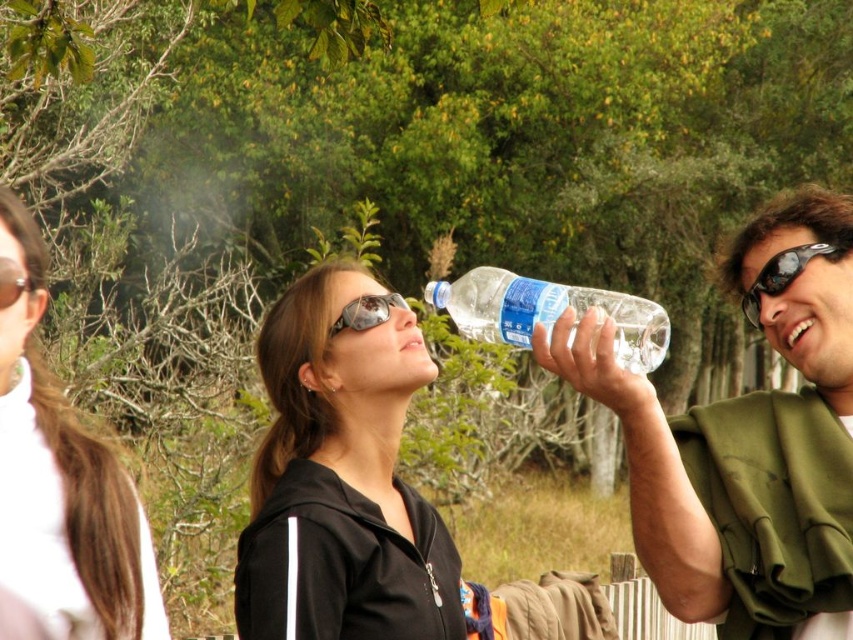
Does matte green scarf at right appear on the left side of matte black goggles at upper center?

No, matte green scarf at right is not to the left of matte black goggles at upper center.

Between point (780, 433) and point (28, 282), which one is positioned behind?

Point (780, 433)

Locate an element on the screen. Image resolution: width=853 pixels, height=640 pixels. matte green scarf at right is located at coordinates (747, 442).

Between white fabric hair at upper left and black plastic sunglasses at upper right, which one is positioned lower?

white fabric hair at upper left is lower down.

Consider the image. Does white fabric hair at upper left have a greater height compared to black plastic sunglasses at upper right?

Indeed, white fabric hair at upper left has a greater height compared to black plastic sunglasses at upper right.

Locate an element on the screen. This screenshot has width=853, height=640. white fabric hair at upper left is located at coordinates (62, 486).

Measure the distance between black matte jacket at center and camera.

black matte jacket at center and camera are 3.57 meters apart.

Is black matte jacket at center taller than matte black goggles at upper center?

Yes.

Image resolution: width=853 pixels, height=640 pixels. What are the coordinates of `black matte jacket at center` in the screenshot? It's located at (341, 481).

I want to click on black matte jacket at center, so click(x=341, y=481).